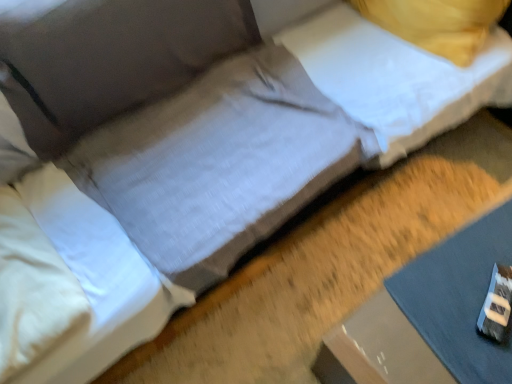
The width and height of the screenshot is (512, 384). In order to click on gray fabric sheet at lower right in this screenshot , I will do `click(459, 298)`.

At what (x,y) coordinates should I click in order to perform the action: click on white soft pillow at upper right, the first pillow in the top-to-bottom sequence. Please return your answer as a coordinate pair (x, y). Looking at the image, I should click on (396, 80).

Locate an element on the screen. The image size is (512, 384). white soft pillow at left, the second pillow from the top is located at coordinates (31, 288).

Considering the relative sizes of white soft pillow at upper right, which is counted as the 2th pillow, starting from the bottom, and white soft pillow at left, the first pillow in the bottom-to-top sequence, in the image provided, is white soft pillow at upper right, which is counted as the 2th pillow, starting from the bottom, smaller than white soft pillow at left, the first pillow in the bottom-to-top sequence,?

Actually, white soft pillow at upper right, which is counted as the 2th pillow, starting from the bottom, might be larger than white soft pillow at left, the first pillow in the bottom-to-top sequence.

Can you confirm if white soft pillow at upper right, which is counted as the 2th pillow, starting from the bottom, is wider than white soft pillow at left, which is the 2th pillow from right to left?

In fact, white soft pillow at upper right, which is counted as the 2th pillow, starting from the bottom, might be narrower than white soft pillow at left, which is the 2th pillow from right to left.

Which is closer to the camera, (335, 28) or (1, 228)?

Point (335, 28) is positioned farther from the camera compared to point (1, 228).

Is white soft pillow at upper right, which is counted as the 2th pillow, starting from the bottom, at the right side of white soft pillow at left, the second pillow from the top?

Correct, you'll find white soft pillow at upper right, which is counted as the 2th pillow, starting from the bottom, to the right of white soft pillow at left, the second pillow from the top.

Which is closer, (426,301) or (310,42)?

The point (426,301) is closer.

Is gray fabric sheet at lower right shorter than white soft pillow at upper right, the 2th pillow in the left-to-right sequence?

Yes.

Between gray fabric sheet at lower right and white soft pillow at upper right, the 2th pillow in the left-to-right sequence, which one appears on the left side from the viewer's perspective?

white soft pillow at upper right, the 2th pillow in the left-to-right sequence, is more to the left.

Is white soft pillow at left, which is the 1th pillow in front-to-back order, completely or partially inside gray fabric sheet at lower right?

No, gray fabric sheet at lower right does not contain white soft pillow at left, which is the 1th pillow in front-to-back order.

Is gray fabric sheet at lower right beside white soft pillow at left, the second pillow when ordered from back to front?

No, gray fabric sheet at lower right is not making contact with white soft pillow at left, the second pillow when ordered from back to front.

Looking at this image, considering the positions of objects gray fabric sheet at lower right and white soft pillow at left, the second pillow when ordered from back to front, in the image provided, who is more to the right, gray fabric sheet at lower right or white soft pillow at left, the second pillow when ordered from back to front,?

gray fabric sheet at lower right is more to the right.

Can you confirm if gray fabric sheet at lower right is taller than white soft pillow at left, which is the 2th pillow from right to left?

Incorrect, the height of gray fabric sheet at lower right is not larger of that of white soft pillow at left, which is the 2th pillow from right to left.

Considering their positions, is white soft pillow at left, the second pillow when ordered from back to front, located in front of or behind gray fabric sheet at lower right?

Visually, white soft pillow at left, the second pillow when ordered from back to front, is located in front of gray fabric sheet at lower right.

Consider the image. Is white soft pillow at left, the second pillow when ordered from back to front, positioned with its back to gray fabric sheet at lower right?

That's not correct — white soft pillow at left, the second pillow when ordered from back to front, is not looking away from gray fabric sheet at lower right.

In the scene shown: Is white soft pillow at left, the second pillow when ordered from back to front, next to gray fabric sheet at lower right?

white soft pillow at left, the second pillow when ordered from back to front, and gray fabric sheet at lower right are clearly separated.

In the image, is white soft pillow at left, the second pillow from the top, positioned in front of or behind white soft pillow at upper right, the 2th pillow in the left-to-right sequence?

white soft pillow at left, the second pillow from the top, is positioned closer to the viewer than white soft pillow at upper right, the 2th pillow in the left-to-right sequence.

Is white soft pillow at left, the second pillow when ordered from back to front, positioned with its back to white soft pillow at upper right, which ranks as the 1th pillow in right-to-left order?

That's not correct — white soft pillow at left, the second pillow when ordered from back to front, is not looking away from white soft pillow at upper right, which ranks as the 1th pillow in right-to-left order.

Between white soft pillow at left, the second pillow from the top, and white soft pillow at upper right, which is the 2th pillow in front-to-back order, which one has smaller size?

white soft pillow at left, the second pillow from the top.

Who is taller, white soft pillow at left, which is the 1th pillow in front-to-back order, or white soft pillow at upper right, which ranks as the 1th pillow in right-to-left order?

Standing taller between the two is white soft pillow at upper right, which ranks as the 1th pillow in right-to-left order.

In the scene shown: Can you confirm if white soft pillow at upper right, which is the 2th pillow in front-to-back order, is thinner than gray fabric sheet at lower right?

Correct, the width of white soft pillow at upper right, which is the 2th pillow in front-to-back order, is less than that of gray fabric sheet at lower right.

Is white soft pillow at upper right, which is counted as the 1th pillow, starting from the back, to the left of gray fabric sheet at lower right from the viewer's perspective?

Indeed, white soft pillow at upper right, which is counted as the 1th pillow, starting from the back, is positioned on the left side of gray fabric sheet at lower right.

From the image's perspective, is white soft pillow at upper right, which is counted as the 1th pillow, starting from the back, over gray fabric sheet at lower right?

Indeed, from the image's perspective, white soft pillow at upper right, which is counted as the 1th pillow, starting from the back, is shown above gray fabric sheet at lower right.

From a real-world perspective, between white soft pillow at upper right, the first pillow in the top-to-bottom sequence, and gray fabric sheet at lower right, who is vertically lower?

In real-world perspective, gray fabric sheet at lower right is lower.

The width and height of the screenshot is (512, 384). I want to click on pillow on the left side of white soft pillow at upper right, which is counted as the 1th pillow, starting from the back, so click(x=31, y=288).

I want to click on sheet in front of the white soft pillow at upper right, the first pillow in the top-to-bottom sequence, so click(x=459, y=298).

Based on their spatial positions, is gray fabric sheet at lower right or white soft pillow at left, positioned as the 1th pillow in left-to-right order, further from white soft pillow at upper right, which ranks as the 1th pillow in right-to-left order?

white soft pillow at left, positioned as the 1th pillow in left-to-right order, lies further to white soft pillow at upper right, which ranks as the 1th pillow in right-to-left order, than the other object.

From the image, which object appears to be farther from gray fabric sheet at lower right, white soft pillow at left, the first pillow in the bottom-to-top sequence, or white soft pillow at upper right, the 2th pillow in the left-to-right sequence?

Among the two, white soft pillow at left, the first pillow in the bottom-to-top sequence, is located further to gray fabric sheet at lower right.

From the image, which object appears to be nearer to white soft pillow at left, the second pillow from the top, white soft pillow at upper right, which is counted as the 2th pillow, starting from the bottom, or gray fabric sheet at lower right?

gray fabric sheet at lower right lies closer to white soft pillow at left, the second pillow from the top, than the other object.

From the image, which object appears to be farther from white soft pillow at left, the second pillow when ordered from back to front, gray fabric sheet at lower right or white soft pillow at upper right, which is counted as the 2th pillow, starting from the bottom?

white soft pillow at upper right, which is counted as the 2th pillow, starting from the bottom, is positioned further to the anchor white soft pillow at left, the second pillow when ordered from back to front.

Which object lies nearer to the anchor point gray fabric sheet at lower right, white soft pillow at upper right, the 2th pillow in the left-to-right sequence, or white soft pillow at left, which is the 2th pillow from right to left?

Among the two, white soft pillow at upper right, the 2th pillow in the left-to-right sequence, is located nearer to gray fabric sheet at lower right.

From the image, which object appears to be nearer to white soft pillow at upper right, the 2th pillow in the left-to-right sequence, white soft pillow at left, the second pillow from the top, or gray fabric sheet at lower right?

Among the two, gray fabric sheet at lower right is located nearer to white soft pillow at upper right, the 2th pillow in the left-to-right sequence.

I want to click on pillow situated between white soft pillow at left, the second pillow from the top, and gray fabric sheet at lower right from left to right, so click(396, 80).